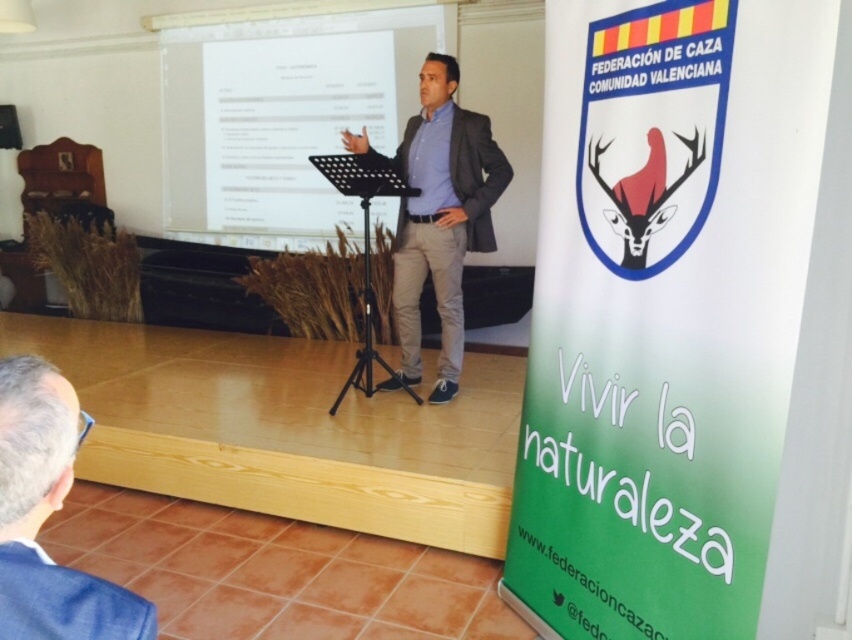
The width and height of the screenshot is (852, 640). What do you see at coordinates (283, 115) in the screenshot?
I see `white glossy projector screen at upper center` at bounding box center [283, 115].

Is white glossy projector screen at upper center taller than gray fabric suit at lower left?

Yes.

Locate an element on the screen. white glossy projector screen at upper center is located at coordinates (283, 115).

Between white glossy projector screen at upper center and dark gray suit at center, which one has less height?

white glossy projector screen at upper center

Measure the distance between white glossy projector screen at upper center and camera.

white glossy projector screen at upper center is 4.95 meters away from camera.

Image resolution: width=852 pixels, height=640 pixels. What are the coordinates of `white glossy projector screen at upper center` in the screenshot? It's located at (283, 115).

Does dark gray suit at center have a greater width compared to gray fabric suit at lower left?

Yes.

Which is behind, point (398, 148) or point (117, 618)?

Point (398, 148)

Is point (450, 392) more distant than point (62, 392)?

That is True.

This screenshot has width=852, height=640. What are the coordinates of `dark gray suit at center` in the screenshot? It's located at (438, 216).